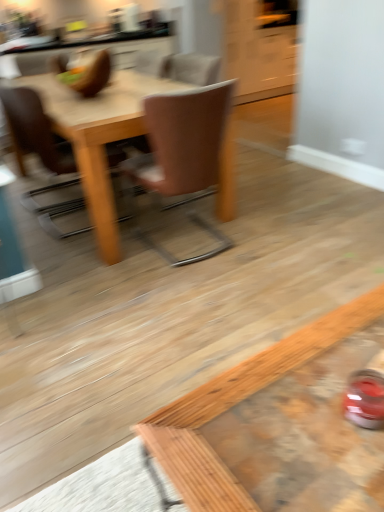
You are a GUI agent. You are given a task and a screenshot of the screen. Output one action in this format:
    pyautogui.click(x=<x>, y=<y>)
    Task: Click on the free space to the left of brown leather chair at center, which is the first chair from right to left
    The image size is (384, 512).
    Given the screenshot: What is the action you would take?
    pyautogui.click(x=94, y=250)